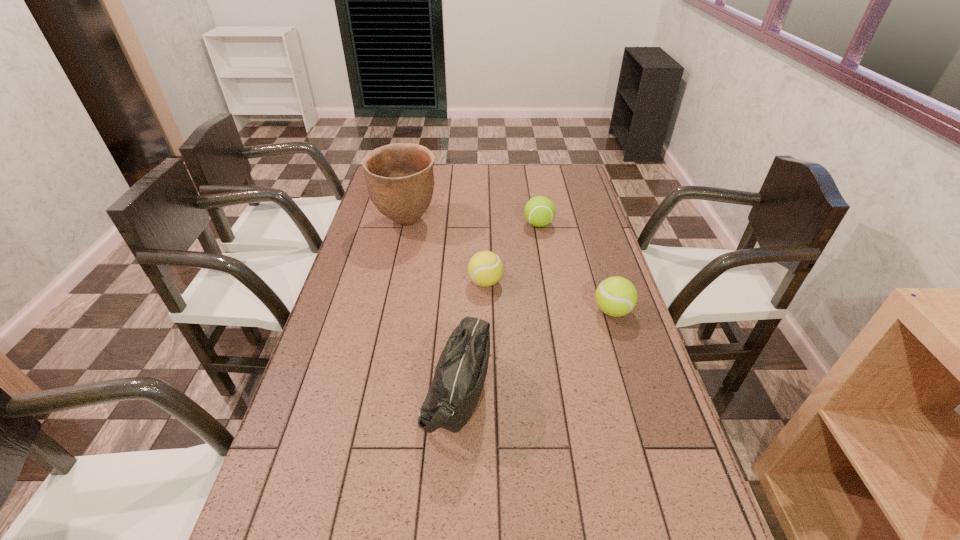
Locate an element on the screen. tennis ball that is the nearest to the rightmost tennis ball is located at coordinates (485, 268).